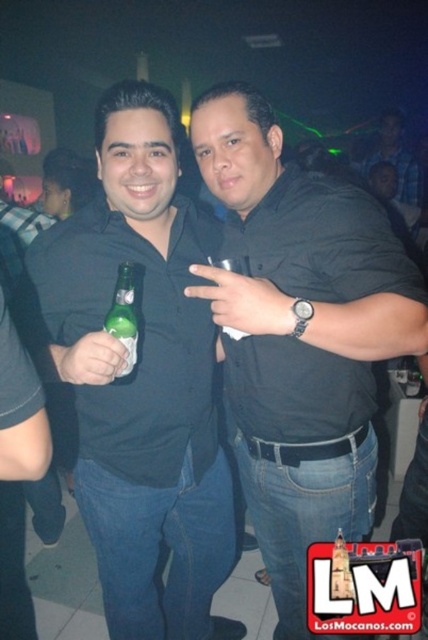
Question: Does blue plaid shirt at upper right appear on the left side of green glass bottle at center?

Choices:
 (A) no
 (B) yes

Answer: (A)

Question: In this image, where is black matte shirt at center located relative to blue plaid shirt at upper right?

Choices:
 (A) left
 (B) right

Answer: (A)

Question: Which of the following is the closest to the observer?

Choices:
 (A) blue plaid shirt at upper right
 (B) green glass bottle at center
 (C) black matte shirt at center

Answer: (B)

Question: Among these points, which one is nearest to the camera?

Choices:
 (A) (377, 160)
 (B) (374, 282)
 (C) (125, 342)

Answer: (C)

Question: Is green matte bottle at left above black matte shirt at center?

Choices:
 (A) yes
 (B) no

Answer: (A)

Question: Among these objects, which one is farthest from the camera?

Choices:
 (A) green matte bottle at left
 (B) blue plaid shirt at upper right
 (C) black matte shirt at center

Answer: (B)